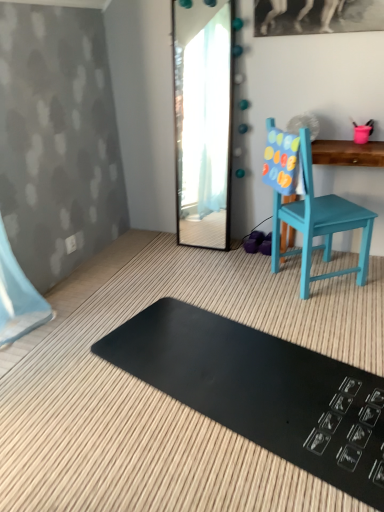
This screenshot has height=512, width=384. Identify the location of free point to the left of teal painted wood chair at right. pyautogui.click(x=243, y=284).